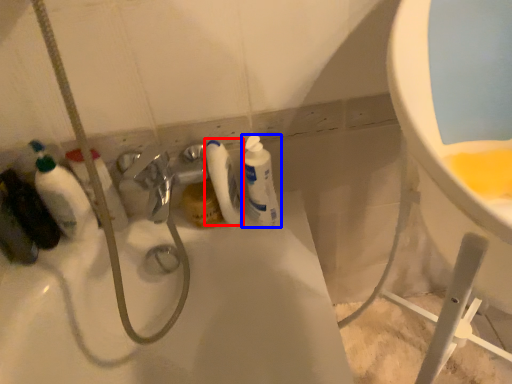
Question: Which point is further to the camera, cleaning product (highlighted by a red box) or cleaning product (highlighted by a blue box)?

Choices:
 (A) cleaning product
 (B) cleaning product

Answer: (A)